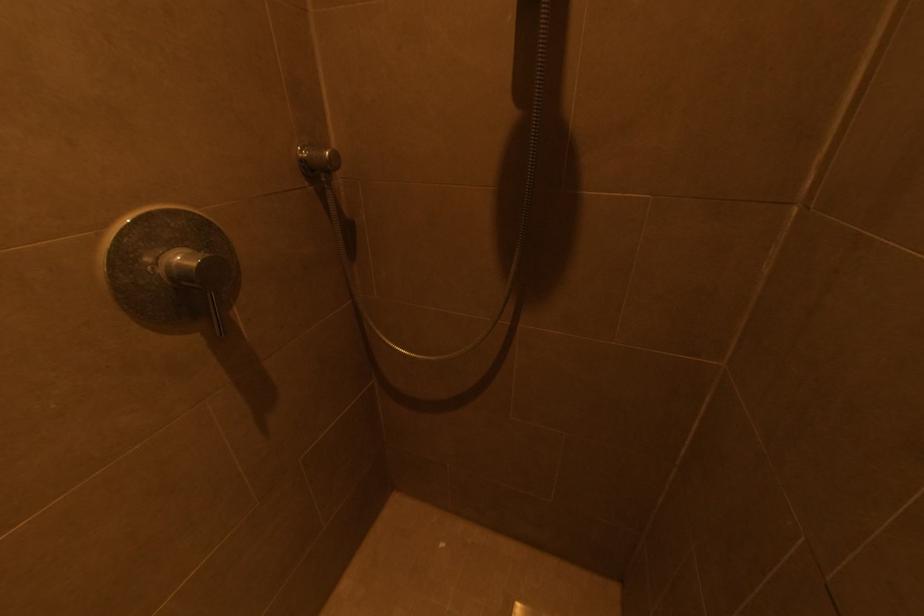
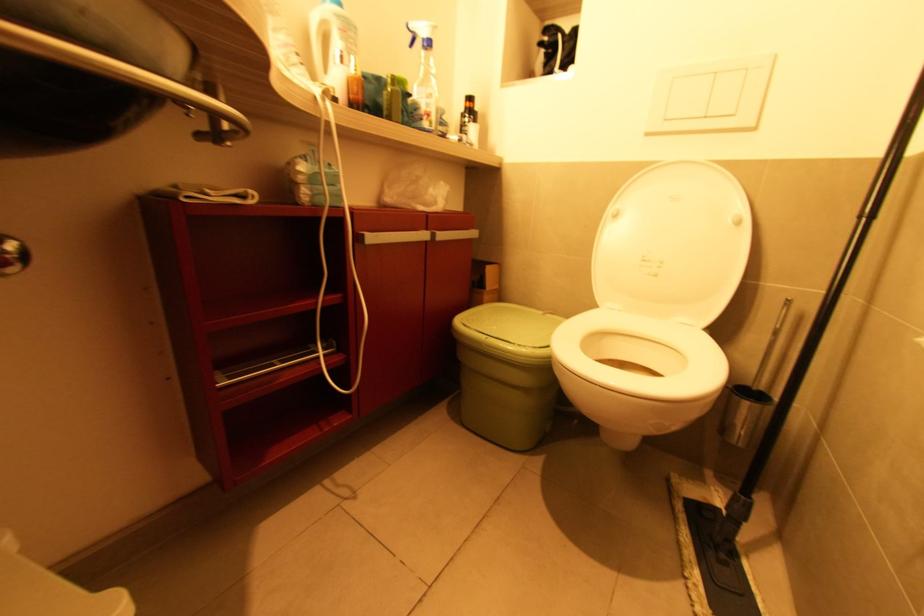
Question: The camera is either moving clockwise (left) or counter-clockwise (right) around the object. The first image is from the beginning of the video and the second image is from the end. Is the camera moving left or right when shooting the video?

Choices:
 (A) Left
 (B) Right

Answer: (A)